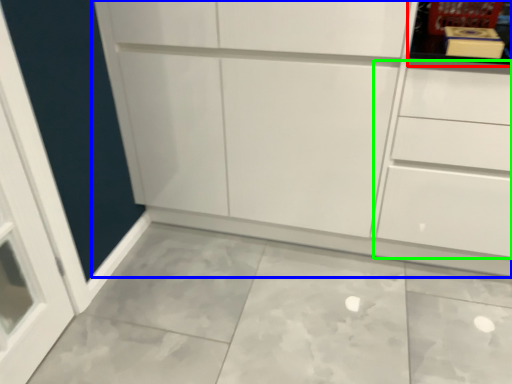
Question: Estimate the real-world distances between objects in this image. Which object is closer to shelf (highlighted by a red box), cupboard (highlighted by a blue box) or drawer (highlighted by a green box)?

Choices:
 (A) cupboard
 (B) drawer

Answer: (B)